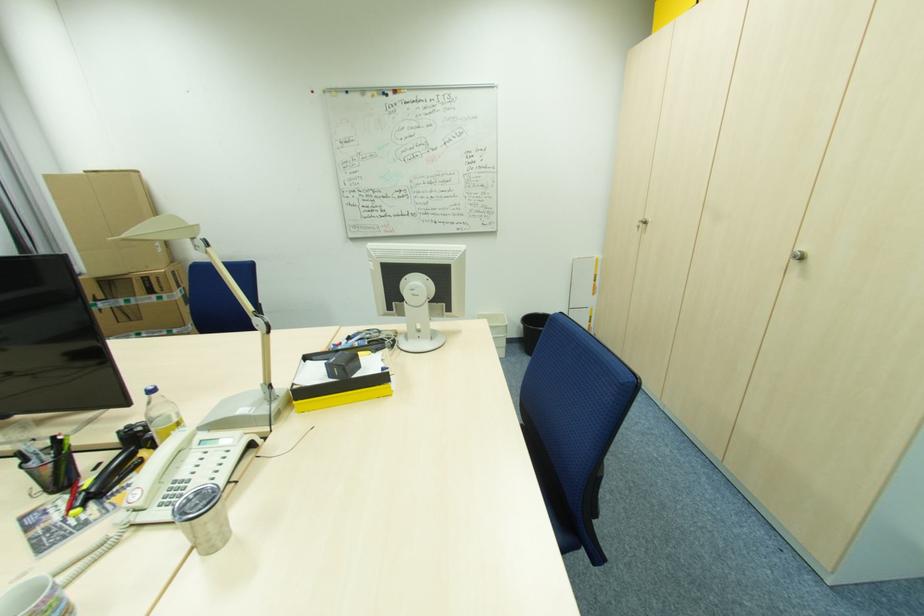
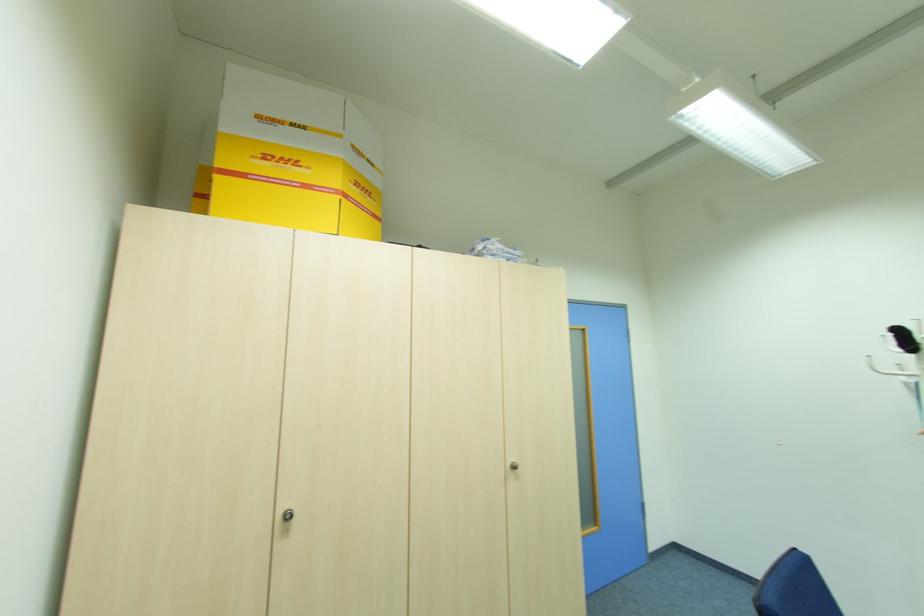
Where in the second image is the point corresponding to [806,248] from the first image?

(513, 460)